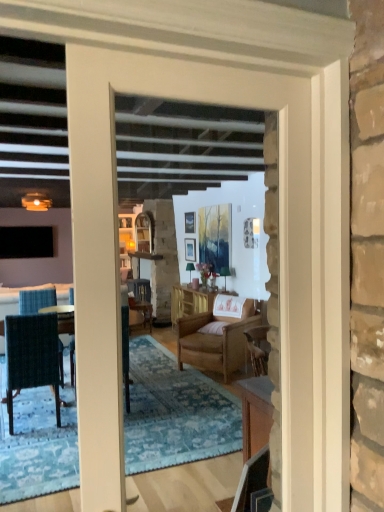
Question: Considering the relative sizes of white wood door at center and wooden cabinet at center in the image provided, is white wood door at center smaller than wooden cabinet at center?

Choices:
 (A) no
 (B) yes

Answer: (B)

Question: Does white wood door at center have a lesser width compared to wooden cabinet at center?

Choices:
 (A) yes
 (B) no

Answer: (A)

Question: Are white wood door at center and wooden cabinet at center far apart?

Choices:
 (A) yes
 (B) no

Answer: (A)

Question: Considering the relative positions of white wood door at center and wooden cabinet at center in the image provided, is white wood door at center to the right of wooden cabinet at center from the viewer's perspective?

Choices:
 (A) no
 (B) yes

Answer: (A)

Question: Is white wood door at center shorter than wooden cabinet at center?

Choices:
 (A) yes
 (B) no

Answer: (B)

Question: Is matte white picture frame at upper center, which appears as the second picture frame when viewed from the top, inside the boundaries of wooden picture frame at upper center, the first picture frame viewed from the top, or outside?

Choices:
 (A) inside
 (B) outside

Answer: (B)

Question: From a real-world perspective, relative to wooden picture frame at upper center, the first picture frame viewed from the top, is matte white picture frame at upper center, which appears as the second picture frame when viewed from the top, vertically above or below?

Choices:
 (A) above
 (B) below

Answer: (B)

Question: Considering the positions of matte white picture frame at upper center, which appears as the second picture frame when viewed from the top, and wooden picture frame at upper center, which is the second picture frame in bottom-to-top order, in the image, is matte white picture frame at upper center, which appears as the second picture frame when viewed from the top, bigger or smaller than wooden picture frame at upper center, which is the second picture frame in bottom-to-top order,?

Choices:
 (A) big
 (B) small

Answer: (A)

Question: In terms of height, does matte white picture frame at upper center, which appears as the second picture frame when viewed from the top, look taller or shorter compared to wooden picture frame at upper center, which is the second picture frame in bottom-to-top order?

Choices:
 (A) short
 (B) tall

Answer: (B)

Question: From the image's perspective, is white wood door at center above or below dark blue woven chair at left, which ranks as the 1th chair in left-to-right order?

Choices:
 (A) below
 (B) above

Answer: (B)

Question: Would you say white wood door at center is to the left or to the right of dark blue woven chair at left, arranged as the third chair when viewed from the back, in the picture?

Choices:
 (A) left
 (B) right

Answer: (B)

Question: Is white wood door at center taller or shorter than dark blue woven chair at left, the third chair in the right-to-left sequence?

Choices:
 (A) tall
 (B) short

Answer: (A)

Question: In terms of size, does white wood door at center appear bigger or smaller than dark blue woven chair at left, the third chair in the right-to-left sequence?

Choices:
 (A) big
 (B) small

Answer: (B)

Question: Visually, is wooden cabinet at center positioned to the left or to the right of white wood door at center?

Choices:
 (A) left
 (B) right

Answer: (B)

Question: From the image's perspective, is wooden cabinet at center positioned above or below white wood door at center?

Choices:
 (A) above
 (B) below

Answer: (B)